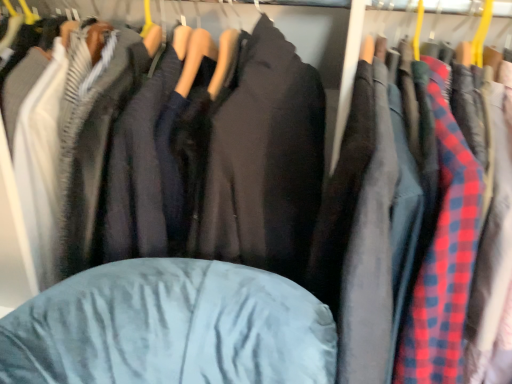
Question: Considering the relative positions of velvet blue jacket at center and velvet blue bean bag at center in the image provided, is velvet blue jacket at center in front of velvet blue bean bag at center?

Choices:
 (A) yes
 (B) no

Answer: (B)

Question: From a real-world perspective, is velvet blue jacket at center physically above velvet blue bean bag at center?

Choices:
 (A) no
 (B) yes

Answer: (B)

Question: From the image's perspective, is velvet blue jacket at center under velvet blue bean bag at center?

Choices:
 (A) yes
 (B) no

Answer: (B)

Question: Is velvet blue jacket at center looking in the opposite direction of velvet blue bean bag at center?

Choices:
 (A) yes
 (B) no

Answer: (B)

Question: Is velvet blue jacket at center smaller than velvet blue bean bag at center?

Choices:
 (A) yes
 (B) no

Answer: (B)

Question: Does velvet blue jacket at center turn towards velvet blue bean bag at center?

Choices:
 (A) no
 (B) yes

Answer: (B)

Question: Does red plaid shirt at center have a lesser height compared to velvet blue jacket at center?

Choices:
 (A) no
 (B) yes

Answer: (A)

Question: From a real-world perspective, is red plaid shirt at center below velvet blue jacket at center?

Choices:
 (A) no
 (B) yes

Answer: (B)

Question: From the image's perspective, is red plaid shirt at center under velvet blue jacket at center?

Choices:
 (A) no
 (B) yes

Answer: (B)

Question: Is red plaid shirt at center positioned far away from velvet blue jacket at center?

Choices:
 (A) yes
 (B) no

Answer: (B)

Question: Can you confirm if red plaid shirt at center is thinner than velvet blue jacket at center?

Choices:
 (A) yes
 (B) no

Answer: (A)

Question: Is red plaid shirt at center at the right side of velvet blue jacket at center?

Choices:
 (A) yes
 (B) no

Answer: (A)

Question: Does velvet blue bean bag at center have a greater width compared to red plaid shirt at center?

Choices:
 (A) yes
 (B) no

Answer: (B)